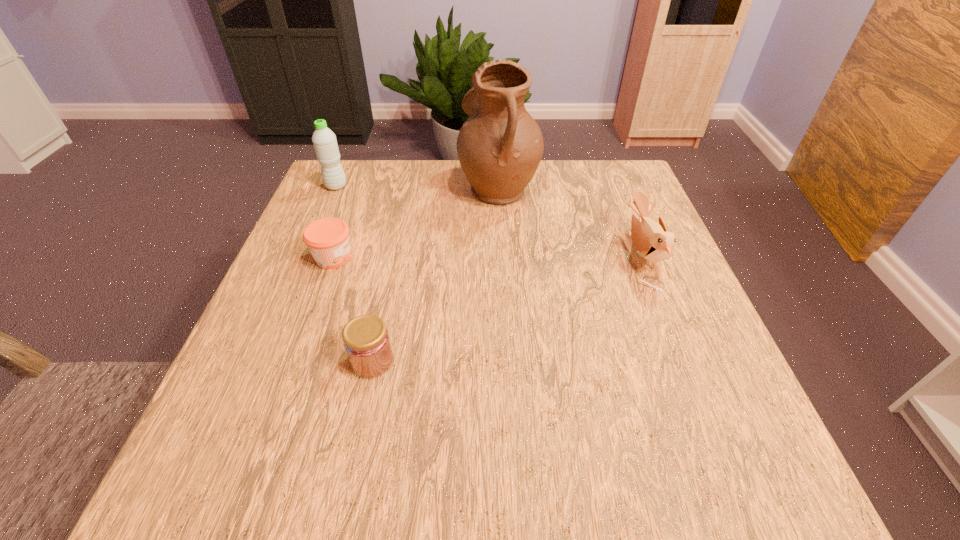
At what (x,y) coordinates should I click in order to perform the action: click on the fourth object from left to right. Please return your answer as a coordinate pair (x, y). This screenshot has width=960, height=540. Looking at the image, I should click on (500, 146).

You are a GUI agent. You are given a task and a screenshot of the screen. Output one action in this format:
    pyautogui.click(x=<x>, y=<y>)
    Task: Click on the pitcher
    
    Given the screenshot: What is the action you would take?
    pyautogui.click(x=500, y=146)

Where is `the fourth shortest object`? This screenshot has height=540, width=960. the fourth shortest object is located at coordinates (324, 140).

What are the coordinates of `bird` in the screenshot? It's located at (651, 239).

Find the location of `the rightmost object`. the rightmost object is located at coordinates (651, 239).

Locate an element on the screen. the third object from right to left is located at coordinates (366, 340).

This screenshot has width=960, height=540. Identify the location of the nearest object. (366, 340).

The height and width of the screenshot is (540, 960). Identify the location of the farther jam. (327, 239).

Locate an element on the screen. This screenshot has width=960, height=540. free location located at the spout of the pitcher is located at coordinates (400, 186).

The height and width of the screenshot is (540, 960). I want to click on free point located at the spout of the pitcher, so click(354, 186).